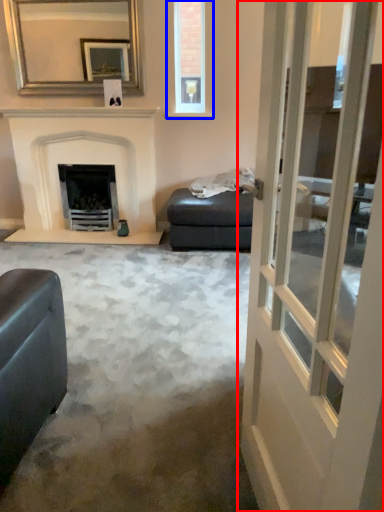
Question: Among these objects, which one is farthest to the camera, door (highlighted by a red box) or window (highlighted by a blue box)?

Choices:
 (A) door
 (B) window

Answer: (B)